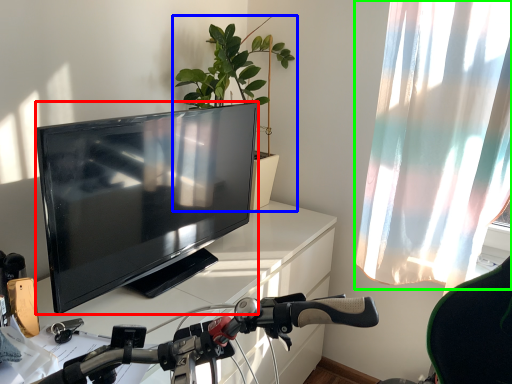
Question: Which object is the closest to the television (highlighted by a red box)? Choose among these: houseplant (highlighted by a blue box) or curtain (highlighted by a green box).

Choices:
 (A) houseplant
 (B) curtain

Answer: (A)